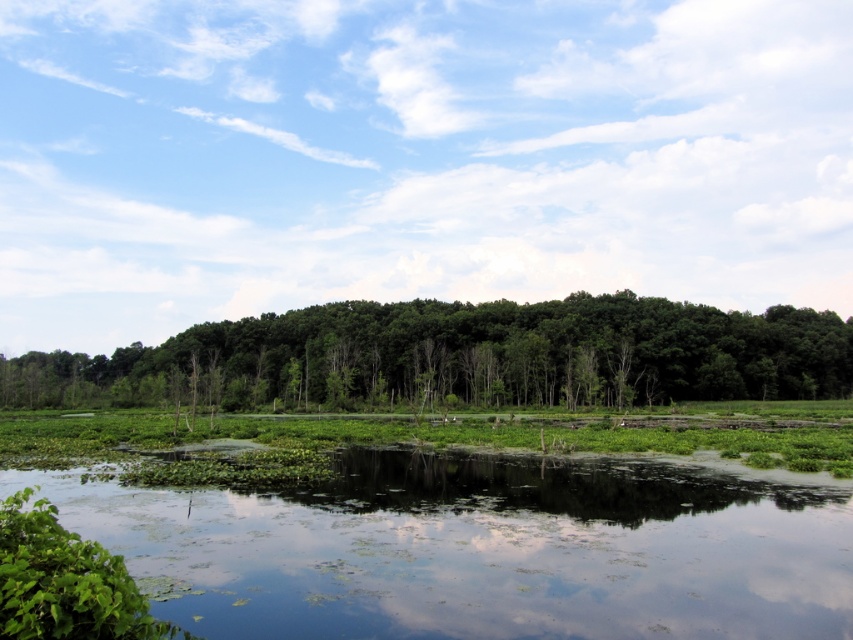
Question: Can you confirm if green leafy water at bottom is wider than green leafy trees at center?

Choices:
 (A) yes
 (B) no

Answer: (B)

Question: Can you confirm if green leafy water at bottom is positioned to the left of green leafy trees at center?

Choices:
 (A) no
 (B) yes

Answer: (A)

Question: Does green leafy water at bottom lie in front of green leafy trees at center?

Choices:
 (A) yes
 (B) no

Answer: (A)

Question: Which point is farther from the camera taking this photo?

Choices:
 (A) (466, 387)
 (B) (311, 582)

Answer: (A)

Question: Which point is closer to the camera?

Choices:
 (A) green leafy water at bottom
 (B) green leafy trees at center

Answer: (A)